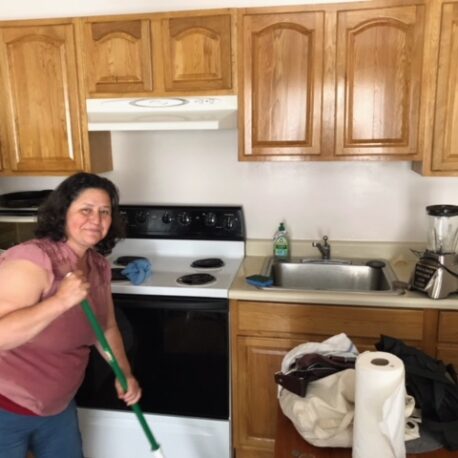
The height and width of the screenshot is (458, 458). I want to click on sink faucet, so click(326, 248).